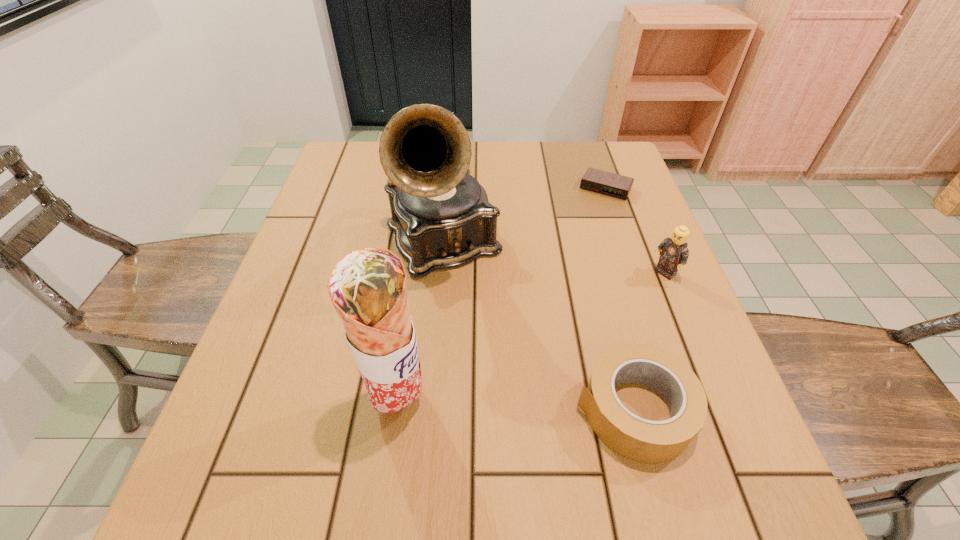
Where is `vacant space at the near left corner of the desktop`? The width and height of the screenshot is (960, 540). vacant space at the near left corner of the desktop is located at coordinates (233, 419).

The image size is (960, 540). What are the coordinates of `vacant area at the far right corner of the desktop` in the screenshot? It's located at (597, 146).

Where is `free point between the Lego and the duct tape`? free point between the Lego and the duct tape is located at coordinates 649,342.

At what (x,y) coordinates should I click in order to perform the action: click on free spot between the phonograph record and the farthest object. Please return your answer as a coordinate pair (x, y). This screenshot has width=960, height=540. Looking at the image, I should click on (524, 215).

Identify the location of vacant region between the duct tape and the tallest object. The image size is (960, 540). (539, 326).

Locate an element on the screen. This screenshot has width=960, height=540. vacant point located between the fourth tallest object and the third tallest object is located at coordinates (649, 342).

Where is `vacant point located between the phonograph record and the farthest object`? The height and width of the screenshot is (540, 960). vacant point located between the phonograph record and the farthest object is located at coordinates (524, 215).

At what (x,y) coordinates should I click in order to perform the action: click on vacant area between the second tallest object and the phonograph record. Please return your answer as a coordinate pair (x, y). This screenshot has width=960, height=540. Looking at the image, I should click on (421, 322).

Where is `vacant space that's between the fourth tallest object and the phonograph record`? The width and height of the screenshot is (960, 540). vacant space that's between the fourth tallest object and the phonograph record is located at coordinates (539, 326).

At what (x,y) coordinates should I click in order to perform the action: click on vacant area between the alarm clock and the tallest object. Please return your answer as a coordinate pair (x, y). This screenshot has width=960, height=540. Looking at the image, I should click on (524, 215).